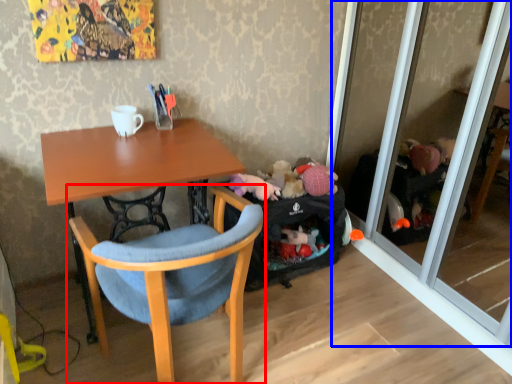
Question: Among these objects, which one is nearest to the camera, chair (highlighted by a red box) or screen door (highlighted by a blue box)?

Choices:
 (A) chair
 (B) screen door

Answer: (A)